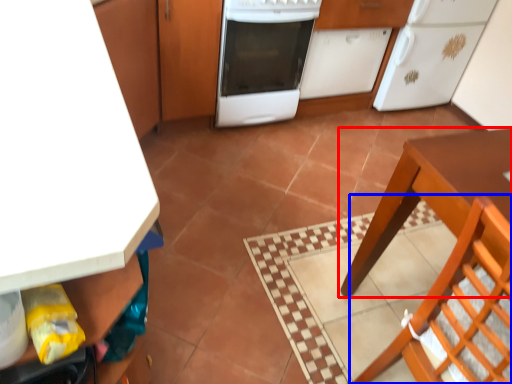
Question: Which point is further to the camera, table (highlighted by a red box) or chair (highlighted by a blue box)?

Choices:
 (A) table
 (B) chair

Answer: (A)